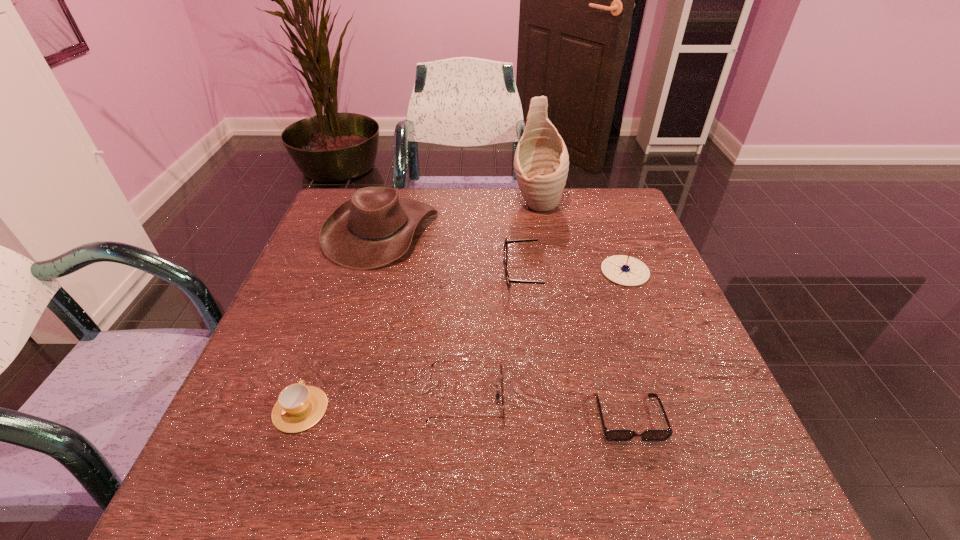
The image size is (960, 540). What are the coordinates of `the fifth closest object to the pitcher` in the screenshot? It's located at (612, 435).

You are a GUI agent. You are given a task and a screenshot of the screen. Output one action in this format:
    pyautogui.click(x=<x>, y=<y>)
    Task: Click on the free space that satisfies the following two spatial constraints: 1. with the handle on the side of the cup; 2. on the right side of the compass
    This screenshot has height=540, width=960.
    Given the screenshot: What is the action you would take?
    pyautogui.click(x=348, y=271)

Locate an element on the screen. The image size is (960, 540). free location that satisfies the following two spatial constraints: 1. with the handle on the side of the cup; 2. on the left side of the compass is located at coordinates (348, 271).